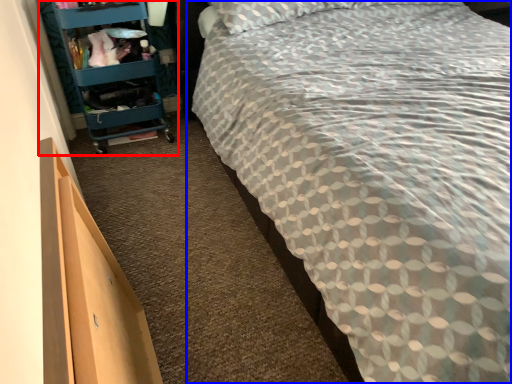
Question: Among these objects, which one is nearest to the camera, furniture (highlighted by a red box) or bed (highlighted by a blue box)?

Choices:
 (A) furniture
 (B) bed

Answer: (B)